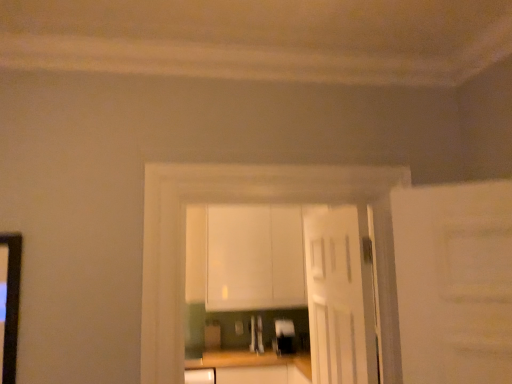
Question: Considering the positions of white matte cabinet at center and satin silver toaster at center, acting as the first appliance starting from the left, in the image, is white matte cabinet at center taller or shorter than satin silver toaster at center, acting as the first appliance starting from the left,?

Choices:
 (A) tall
 (B) short

Answer: (A)

Question: From a real-world perspective, is white matte cabinet at center above or below satin silver toaster at center, which appears as the second appliance when viewed from the right?

Choices:
 (A) above
 (B) below

Answer: (A)

Question: Which object is the closest to the white wooden door at center?

Choices:
 (A) metallic silver toaster at center, acting as the 2th appliance starting from the left
 (B) satin silver toaster at center, which appears as the second appliance when viewed from the right
 (C) white glossy cabinets at center
 (D) wooden at center
 (E) white matte cabinet at center

Answer: (D)

Question: Considering the real-world distances, which object is closest to the white wooden door at center?

Choices:
 (A) wooden at center
 (B) white glossy cabinets at center
 (C) satin silver toaster at center, acting as the first appliance starting from the left
 (D) metallic silver toaster at center, acting as the 2th appliance starting from the left
 (E) white matte cabinet at center

Answer: (A)